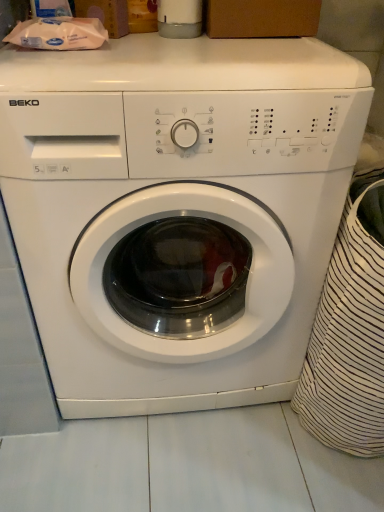
Measure the distance between point (263,114) and camera.

Point (263,114) is 25.16 inches away from camera.

Image resolution: width=384 pixels, height=512 pixels. Describe the element at coordinates (177, 203) in the screenshot. I see `white glossy washing machine at center` at that location.

The image size is (384, 512). Identify the location of white glossy washing machine at center. (177, 203).

Locate an element on the screen. Image resolution: width=384 pixels, height=512 pixels. white glossy washing machine at center is located at coordinates (177, 203).